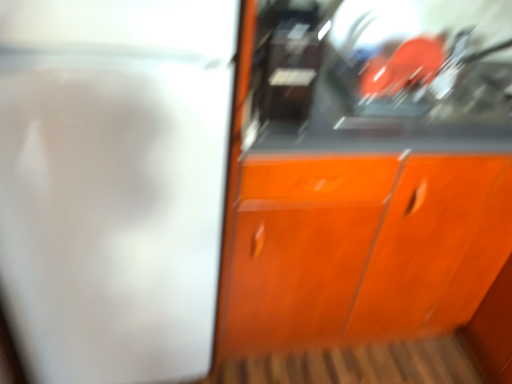
Question: Is white glossy screen door at left wider or thinner than orange wood cabinet at center?

Choices:
 (A) wide
 (B) thin

Answer: (A)

Question: Relative to orange wood cabinet at center, is white glossy screen door at left in front or behind?

Choices:
 (A) front
 (B) behind

Answer: (A)

Question: From a real-world perspective, is white glossy screen door at left above or below orange wood cabinet at center?

Choices:
 (A) below
 (B) above

Answer: (B)

Question: Looking at the image, does orange wood cabinet at center seem bigger or smaller compared to white glossy screen door at left?

Choices:
 (A) small
 (B) big

Answer: (B)

Question: Does point (474, 61) appear closer or farther from the camera than point (72, 317)?

Choices:
 (A) closer
 (B) farther

Answer: (B)

Question: From a real-world perspective, relative to white glossy screen door at left, is orange wood cabinet at center vertically above or below?

Choices:
 (A) above
 (B) below

Answer: (B)

Question: Relative to white glossy screen door at left, is orange wood cabinet at center in front or behind?

Choices:
 (A) behind
 (B) front

Answer: (A)